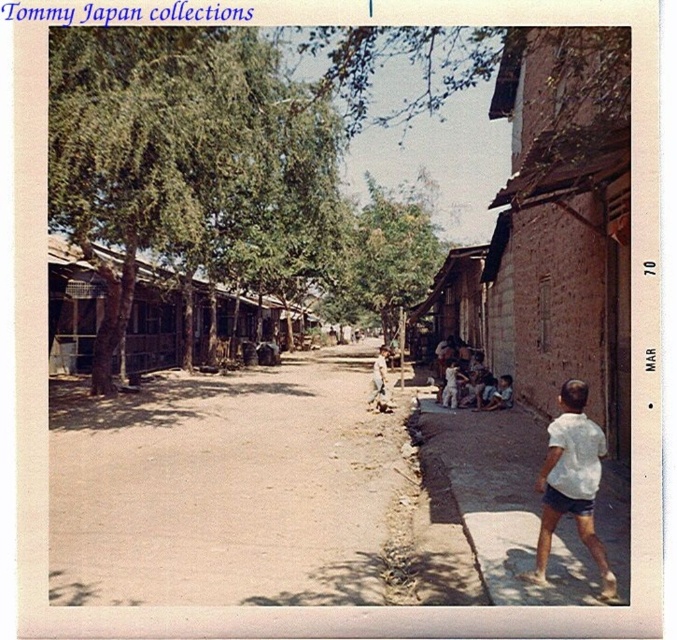
You are a photographer standing in the middle of the street, and you want to take a picture of both the white matte shirt at lower right and the light brown wooden stick at center. Which object should you position to your left to include both in the frame?

You should position the light brown wooden stick at center to your left because the white matte shirt at lower right is to the right of the light brown wooden stick at center.

Consider the image. You are a photographer standing on the street in the image. You notice a white matte shirt at lower right and a light brown wooden stick at center. Which object is positioned higher from the ground?

The white matte shirt at lower right is above the light brown wooden stick at center, so it is positioned higher from the ground.

You are standing on the street in the image and see a point marked at coordinates (571, 483). What object in the scene corresponds to this point?

The point at coordinates (571, 483) corresponds to the white matte shirt at lower right.